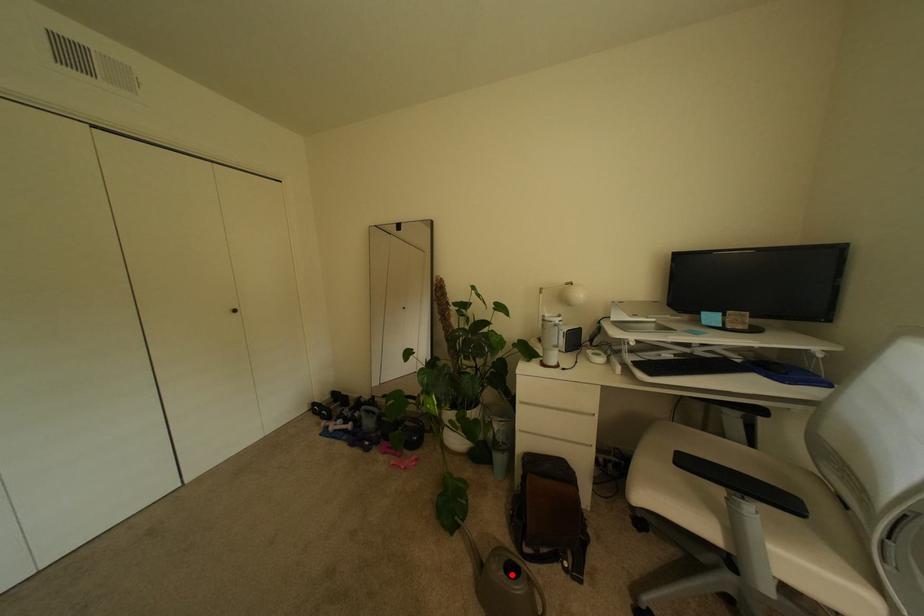
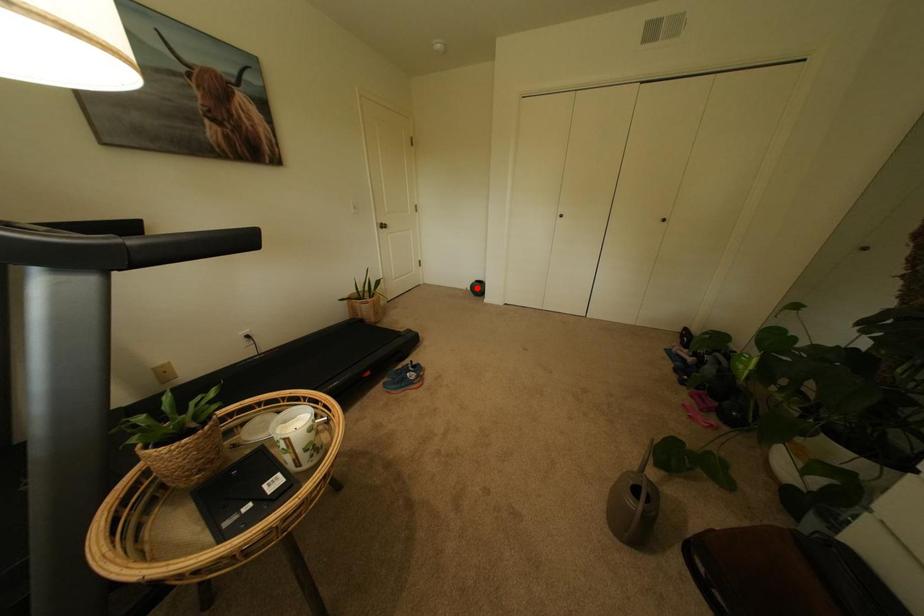
I am providing you with two images of the same scene from different viewpoints. A red point is marked on the first image and another point is marked on the second image. Is the red point in image1 aligned with the point shown in image2?

No